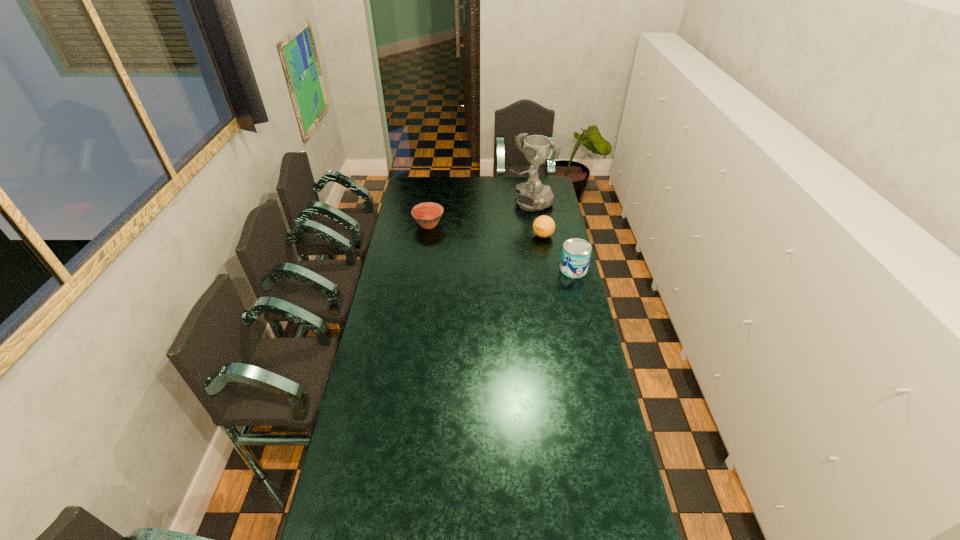
You are a GUI agent. You are given a task and a screenshot of the screen. Output one action in this format:
    pyautogui.click(x=<x>, y=<y>)
    Task: Click on the free spot that satisfies the following two spatial constraints: 1. on the front side of the second tallest object; 2. on the right side of the shortest object
    The image size is (960, 540).
    Given the screenshot: What is the action you would take?
    pyautogui.click(x=422, y=269)